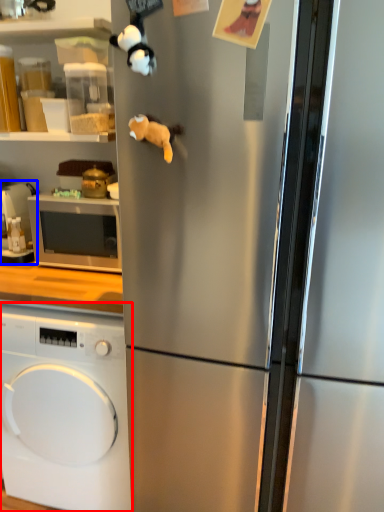
Question: Among these objects, which one is farthest to the camera, washing machine (highlighted by a red box) or appliance (highlighted by a blue box)?

Choices:
 (A) washing machine
 (B) appliance

Answer: (B)